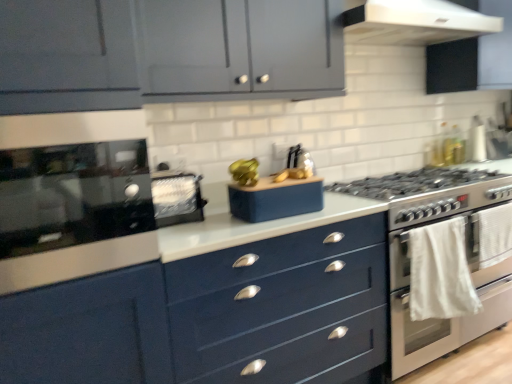
Describe the element at coordinates (166, 52) in the screenshot. Image resolution: width=512 pixels, height=384 pixels. I see `matte gray cabinets at upper center` at that location.

You are a GUI agent. You are given a task and a screenshot of the screen. Output one action in this format:
    pyautogui.click(x=<x>, y=<y>)
    Task: Click on the satin black toaster at upper left, which is the 1th appliance in left-to-right order
    
    Given the screenshot: What is the action you would take?
    pyautogui.click(x=177, y=198)

Measure the distance between satin black toaster at upper left, the 2th appliance viewed from the right, and camera.

satin black toaster at upper left, the 2th appliance viewed from the right, and camera are 1.57 meters apart from each other.

What is the approximate width of glossy black oven at left?

glossy black oven at left is 16.81 inches wide.

What are the coordinates of `white glossy oven at right` in the screenshot? It's located at (448, 326).

Considering the relative positions of white glossy range hood at upper center and white fabric towel at right in the image provided, is white glossy range hood at upper center to the left of white fabric towel at right from the viewer's perspective?

Yes, white glossy range hood at upper center is to the left of white fabric towel at right.

From the image's perspective, which one is positioned higher, white glossy range hood at upper center or white fabric towel at right?

white glossy range hood at upper center.

How much distance is there between white glossy range hood at upper center and white fabric towel at right?

The distance of white glossy range hood at upper center from white fabric towel at right is 1.15 meters.

Looking at their sizes, would you say matte blue speaker at center, marked as the 2th appliance in a left-to-right arrangement, is wider or thinner than white fabric towel at right?

Clearly, matte blue speaker at center, marked as the 2th appliance in a left-to-right arrangement, has more width compared to white fabric towel at right.

Does matte blue speaker at center, marked as the 2th appliance in a left-to-right arrangement, turn towards white fabric towel at right?

No, matte blue speaker at center, marked as the 2th appliance in a left-to-right arrangement, is not facing towards white fabric towel at right.

Can you confirm if matte blue speaker at center, marked as the 2th appliance in a left-to-right arrangement, is shorter than white fabric towel at right?

Indeed, matte blue speaker at center, marked as the 2th appliance in a left-to-right arrangement, has a lesser height compared to white fabric towel at right.

Considering the sizes of objects matte blue speaker at center, marked as the 2th appliance in a left-to-right arrangement, and white fabric towel at right in the image provided, who is bigger, matte blue speaker at center, marked as the 2th appliance in a left-to-right arrangement, or white fabric towel at right?

matte blue speaker at center, marked as the 2th appliance in a left-to-right arrangement.

From a real-world perspective, who is located higher, satin black toaster at upper left, which is the 1th appliance in left-to-right order, or white fabric towel at right?

satin black toaster at upper left, which is the 1th appliance in left-to-right order, is physically above.

Considering the sizes of objects satin black toaster at upper left, which is the 1th appliance in left-to-right order, and white fabric towel at right in the image provided, who is bigger, satin black toaster at upper left, which is the 1th appliance in left-to-right order, or white fabric towel at right?

With larger size is satin black toaster at upper left, which is the 1th appliance in left-to-right order.

Is satin black toaster at upper left, which is the 1th appliance in left-to-right order, facing towards white fabric towel at right?

No, satin black toaster at upper left, which is the 1th appliance in left-to-right order, does not turn towards white fabric towel at right.

In terms of height, does satin black toaster at upper left, which is the 1th appliance in left-to-right order, look taller or shorter compared to white fabric towel at right?

In the image, satin black toaster at upper left, which is the 1th appliance in left-to-right order, appears to be shorter than white fabric towel at right.

Considering the sizes of objects glossy black oven at left and white glossy oven at right in the image provided, who is wider, glossy black oven at left or white glossy oven at right?

white glossy oven at right is wider.

Can you tell me how much glossy black oven at left and white glossy oven at right differ in facing direction?

They differ by 1.53 degrees in their facing directions.

Is glossy black oven at left in front of or behind white glossy oven at right in the image?

glossy black oven at left is positioned closer to the viewer than white glossy oven at right.

Is glossy black oven at left with white glossy oven at right?

There is a gap between glossy black oven at left and white glossy oven at right.

How many degrees apart are the facing directions of satin black toaster at upper left, which is the 1th appliance in left-to-right order, and white glossy range hood at upper center?

0.269 degrees.

From the image's perspective, which object appears higher, satin black toaster at upper left, the 2th appliance viewed from the right, or white glossy range hood at upper center?

white glossy range hood at upper center, from the image's perspective.

Considering the relative sizes of satin black toaster at upper left, the 2th appliance viewed from the right, and white glossy range hood at upper center in the image provided, is satin black toaster at upper left, the 2th appliance viewed from the right, taller than white glossy range hood at upper center?

No, satin black toaster at upper left, the 2th appliance viewed from the right, is not taller than white glossy range hood at upper center.

This screenshot has height=384, width=512. Identify the location of home appliance lying above the matte gray cabinets at upper center (from the image's perspective). (414, 22).

Considering the relative sizes of white glossy range hood at upper center and matte gray cabinets at upper center in the image provided, is white glossy range hood at upper center shorter than matte gray cabinets at upper center?

Indeed, white glossy range hood at upper center has a lesser height compared to matte gray cabinets at upper center.

Which is in front, white glossy range hood at upper center or matte gray cabinets at upper center?

matte gray cabinets at upper center is more forward.

Consider the image. Is white glossy range hood at upper center smaller than matte gray cabinets at upper center?

Yes, white glossy range hood at upper center is smaller than matte gray cabinets at upper center.

How many degrees apart are the facing directions of navy blue drawer at center and white glossy range hood at upper center?

navy blue drawer at center and white glossy range hood at upper center are facing 0.162 degrees away from each other.

Is navy blue drawer at center closer to the viewer compared to white glossy range hood at upper center?

Yes, navy blue drawer at center is in front of white glossy range hood at upper center.

Considering the relative positions of navy blue drawer at center and white glossy range hood at upper center in the image provided, is navy blue drawer at center to the left of white glossy range hood at upper center from the viewer's perspective?

Yes.

Who is shorter, navy blue drawer at center or white glossy range hood at upper center?

Standing shorter between the two is white glossy range hood at upper center.

Locate an element on the screen. home appliance on the left side of white fabric towel at right is located at coordinates (414, 22).

From a real-world perspective, starting from the white fabric towel at right, which appliance is the 1st one vertically above it? Please provide its 2D coordinates.

[(275, 199)]

Based on their spatial positions, is white glossy range hood at upper center or navy blue drawer at center further from white glossy oven at right?

The object further to white glossy oven at right is white glossy range hood at upper center.

When comparing their distances from satin black toaster at upper left, which is the 1th appliance in left-to-right order, does navy blue drawer at center or white glossy range hood at upper center seem further?

white glossy range hood at upper center is further to satin black toaster at upper left, which is the 1th appliance in left-to-right order.

Which object lies nearer to the anchor point white fabric towel at right, white glossy oven at right or satin black toaster at upper left, which is the 1th appliance in left-to-right order?

white glossy oven at right lies closer to white fabric towel at right than the other object.

Which object lies further to the anchor point white glossy range hood at upper center, white fabric towel at right or matte blue speaker at center, marked as the 2th appliance in a left-to-right arrangement?

white fabric towel at right lies further to white glossy range hood at upper center than the other object.

Which object lies nearer to the anchor point white fabric towel at right, navy blue drawer at center or white glossy range hood at upper center?

navy blue drawer at center lies closer to white fabric towel at right than the other object.

Which object lies nearer to the anchor point matte blue speaker at center, marked as the 1th appliance in a right-to-left arrangement, white glossy range hood at upper center or satin black toaster at upper left, which is the 1th appliance in left-to-right order?

satin black toaster at upper left, which is the 1th appliance in left-to-right order, is closer to matte blue speaker at center, marked as the 1th appliance in a right-to-left arrangement.

Based on the photo, looking at the image, which one is located closer to matte blue speaker at center, marked as the 2th appliance in a left-to-right arrangement, white glossy range hood at upper center or glossy black oven at left?

glossy black oven at left lies closer to matte blue speaker at center, marked as the 2th appliance in a left-to-right arrangement, than the other object.

When comparing their distances from white glossy oven at right, does matte gray cabinets at upper center or glossy black oven at left seem closer?

The object closer to white glossy oven at right is matte gray cabinets at upper center.

This screenshot has width=512, height=384. Identify the location of appliance between satin black toaster at upper left, the 2th appliance viewed from the right, and white glossy oven at right from left to right. (275, 199).

Locate an element on the screen. The image size is (512, 384). material between glossy black oven at left and white glossy oven at right is located at coordinates (440, 272).

Locate an element on the screen. The image size is (512, 384). kitchen appliance between matte gray cabinets at upper center and satin black toaster at upper left, which is the 1th appliance in left-to-right order, from top to bottom is located at coordinates (73, 195).

Locate an element on the screen. The width and height of the screenshot is (512, 384). cabinetry between white glossy range hood at upper center and navy blue drawer at center in the up-down direction is located at coordinates (166, 52).